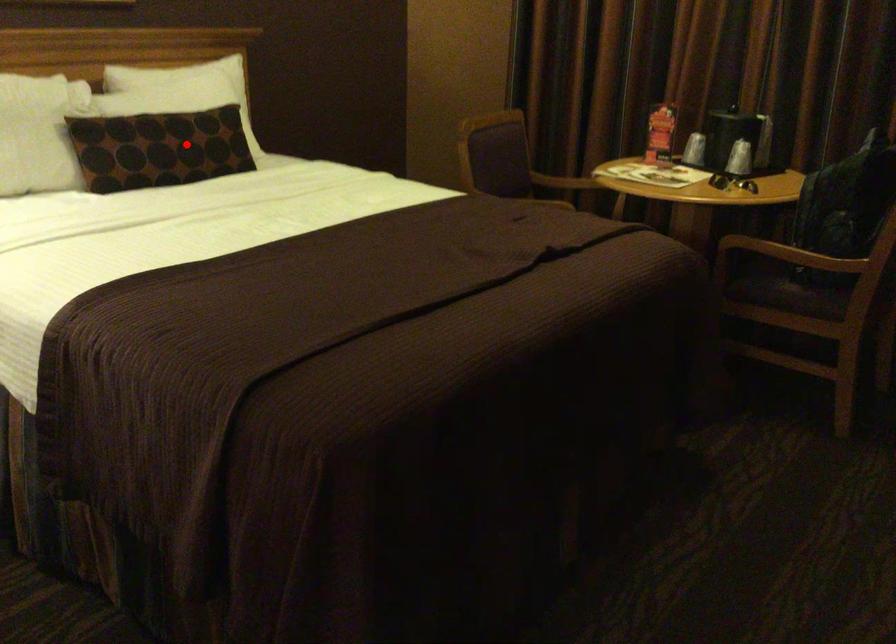
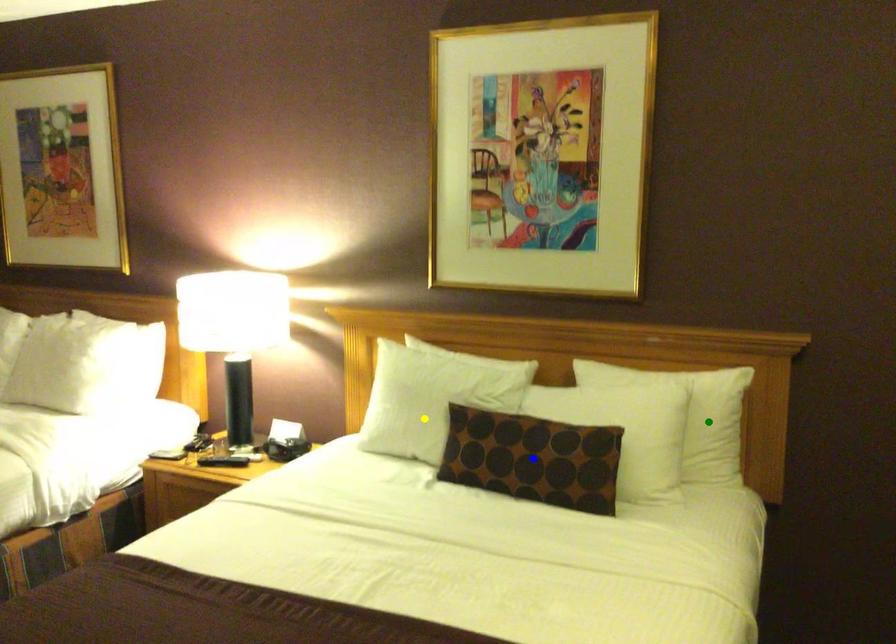
Question: I am providing you with two images of the same scene from different viewpoints. A red point is marked on the first image. You are given multiple points on the second image. Which point in image 2 is actually the same real-world point as the red point in image 1?

Choices:
 (A) yellow point
 (B) green point
 (C) blue point

Answer: (C)